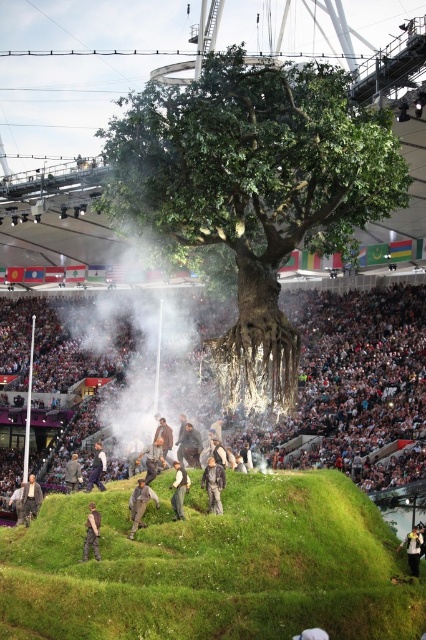
The width and height of the screenshot is (426, 640). Describe the element at coordinates (213, 566) in the screenshot. I see `green grassy hillside at lower center` at that location.

Does green grassy hillside at lower center have a lesser width compared to green fabric pants at center?

In fact, green grassy hillside at lower center might be wider than green fabric pants at center.

Find the location of `green grassy hillside at lower center`. green grassy hillside at lower center is located at coordinates pyautogui.click(x=213, y=566).

Does dark gray woolen suit at lower left appear on the right side of leather jacket at center?

No, dark gray woolen suit at lower left is not to the right of leather jacket at center.

Between dark gray woolen suit at lower left and leather jacket at center, which one appears on the right side from the viewer's perspective?

From the viewer's perspective, leather jacket at center appears more on the right side.

What do you see at coordinates (31, 499) in the screenshot?
I see `dark gray woolen suit at lower left` at bounding box center [31, 499].

The height and width of the screenshot is (640, 426). I want to click on dark gray woolen suit at lower left, so click(x=31, y=499).

Can you confirm if dark gray fabric jacket at center is positioned to the left of camouflage pants at center?

No, dark gray fabric jacket at center is not to the left of camouflage pants at center.

Who is shorter, dark gray fabric jacket at center or camouflage pants at center?

dark gray fabric jacket at center

You are a GUI agent. You are given a task and a screenshot of the screen. Output one action in this format:
    pyautogui.click(x=<x>, y=<y>)
    Task: Click on the dark gray fabric jacket at center
    Image resolution: width=426 pixels, height=640 pixels.
    Given the screenshot: What is the action you would take?
    pyautogui.click(x=213, y=484)